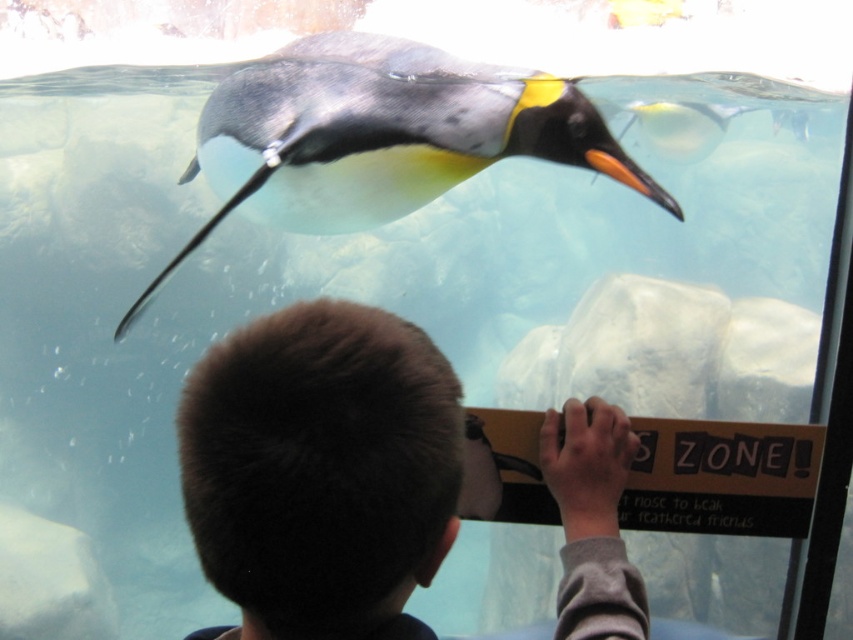
Is short brown hair at lower center wider than black glossy penguin at upper center?

No.

Is short brown hair at lower center to the right of black glossy penguin at upper center from the viewer's perspective?

Correct, you'll find short brown hair at lower center to the right of black glossy penguin at upper center.

Is point (380, 342) positioned in front of point (314, 113)?

Yes, point (380, 342) is closer to viewer.

Locate an element on the screen. The width and height of the screenshot is (853, 640). short brown hair at lower center is located at coordinates [321, 472].